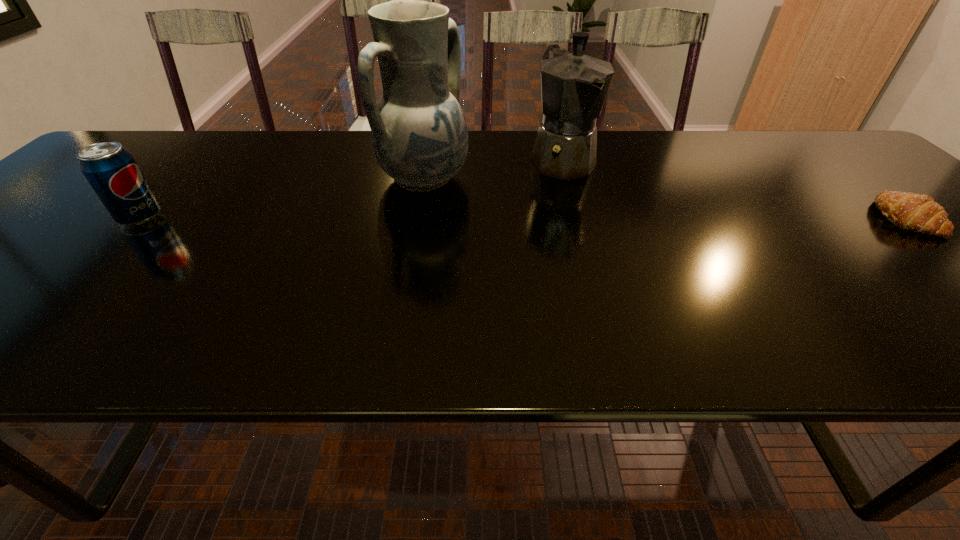
In order to click on free spot on the desktop that is between the leftmost object and the shortest object and is positioned on the front-facing side of the third object from right to left in this screenshot , I will do `click(522, 218)`.

Where is `vacant space on the desktop that is between the soda can and the rightmost object and is positioned on the pouring side of the second object from right to left`? vacant space on the desktop that is between the soda can and the rightmost object and is positioned on the pouring side of the second object from right to left is located at coordinates (615, 218).